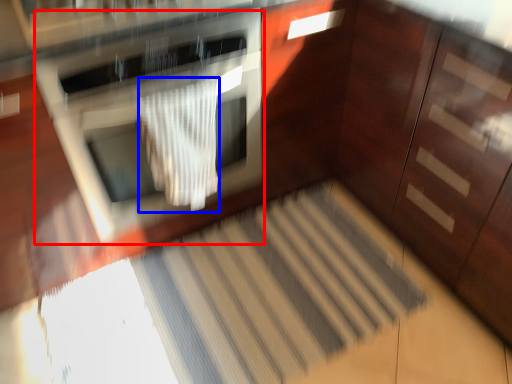
Question: Among these objects, which one is farthest to the camera, oven (highlighted by a red box) or blanket (highlighted by a blue box)?

Choices:
 (A) oven
 (B) blanket

Answer: (B)